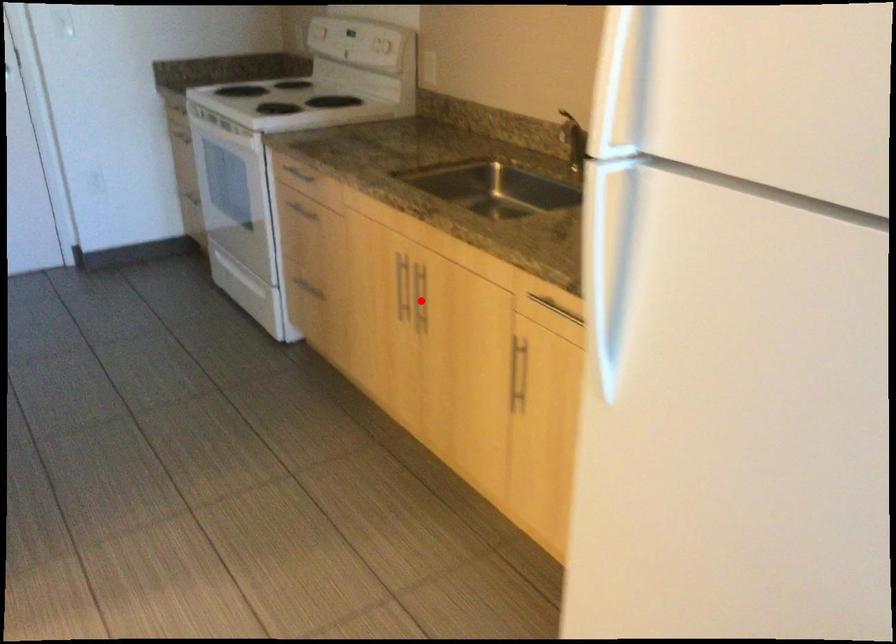
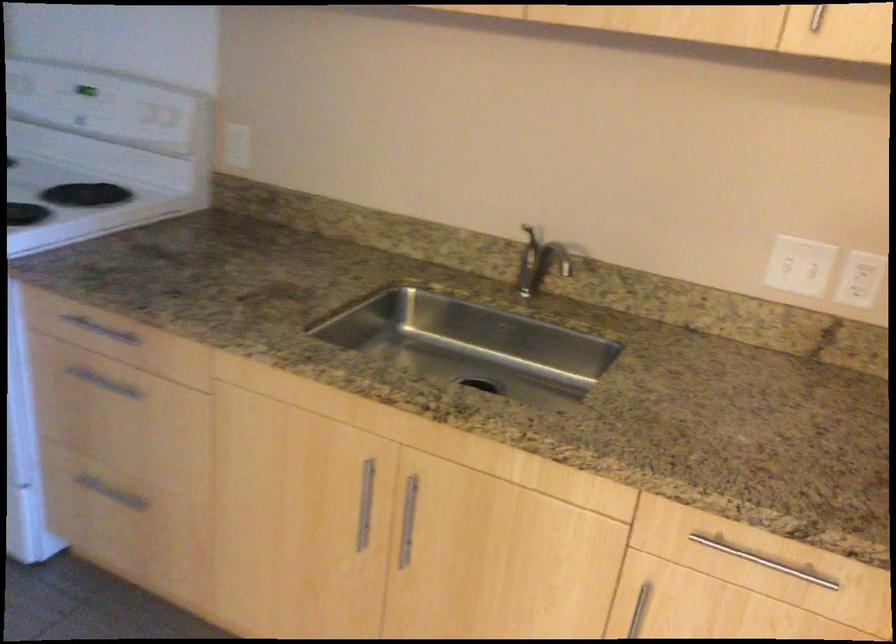
Where in the second image is the point corresponding to the highlighted location from the first image?

(408, 520)